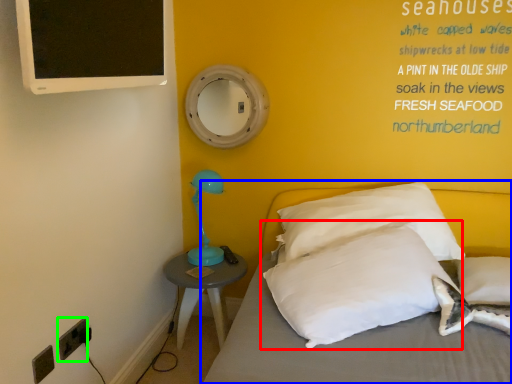
Question: Estimate the real-world distances between objects in this image. Which object is closer to pillow (highlighted by a red box), bed (highlighted by a blue box) or electric outlet (highlighted by a green box)?

Choices:
 (A) bed
 (B) electric outlet

Answer: (A)